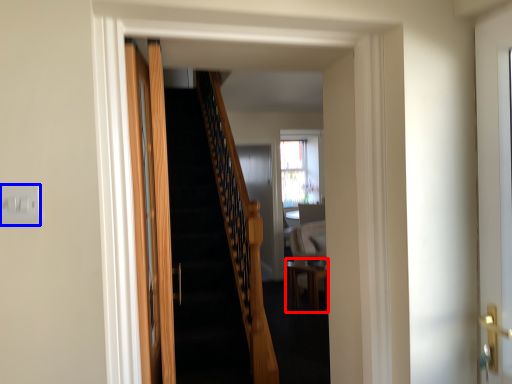
Question: Which point is closer to the camera, table (highlighted by a red box) or electric outlet (highlighted by a blue box)?

Choices:
 (A) table
 (B) electric outlet

Answer: (B)